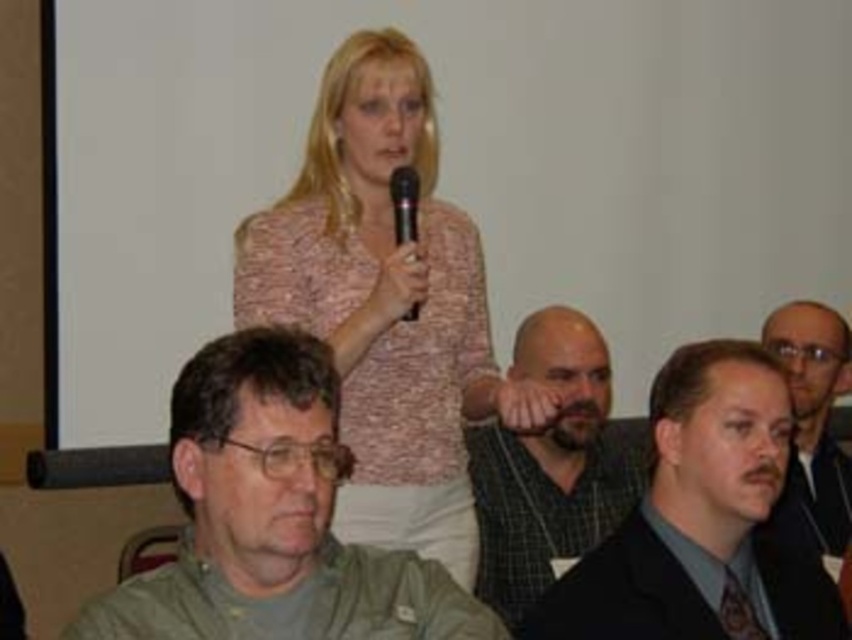
You are an event planner organizing a presentation. You need to ensure that the speaker with the black plastic microphone at center can be seen clearly by the audience seated in front of the green matte shirt at lower left. Is the microphone positioned above or below the shirt?

The green matte shirt at lower left is positioned under the black plastic microphone at center, so the microphone is above the shirt.

You are an attendee at this event and want to locate the pink textured sweater at upper center. Based on the coordinate system where the bottom left corner is the origin, can you determine its location relative to the center of the room?

The pink textured sweater at upper center is located at coordinates approximately 47.7 percent along the horizontal axis and 45.4 percent along the vertical axis from the bottom left corner, which places it slightly to the left and below the center of the room.